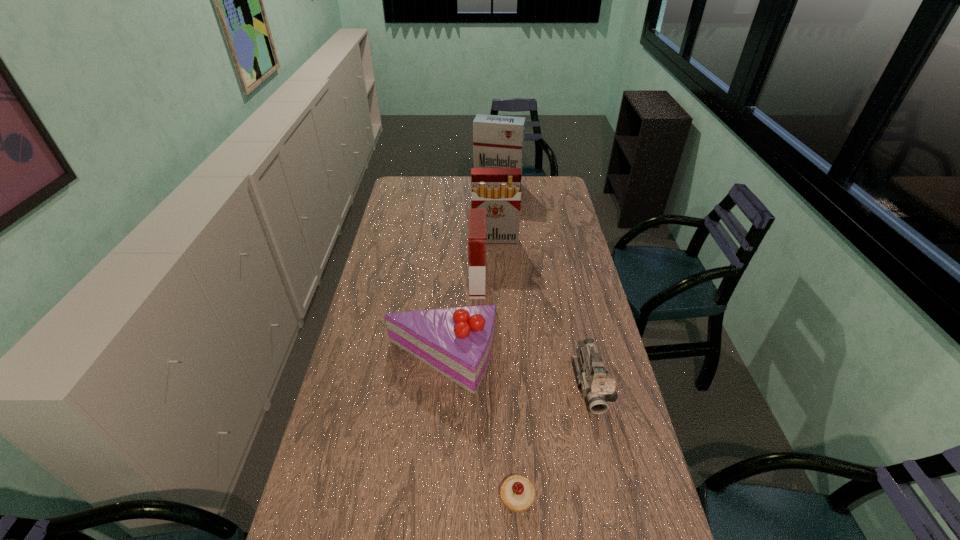
Point out which cigarette_case is positioned as the nearest to the camcorder. Please provide its 2D coordinates. Your answer should be formatted as a tuple, i.e. [(x, y)], where the tuple contains the x and y coordinates of a point satisfying the conditions above.

[(477, 217)]

Locate an element on the screen. vacant region that satisfies the following two spatial constraints: 1. with the lid open on the second farthest object; 2. on the left side of the shortest object is located at coordinates (506, 497).

This screenshot has width=960, height=540. Find the location of `free space that satisfies the following two spatial constraints: 1. on the front-facing side of the nearest cigarette_case; 2. on the back side of the shortest object`. free space that satisfies the following two spatial constraints: 1. on the front-facing side of the nearest cigarette_case; 2. on the back side of the shortest object is located at coordinates (476, 497).

At what (x,y) coordinates should I click in order to perform the action: click on vacant point that satisfies the following two spatial constraints: 1. on the back side of the pastry; 2. on the front-facing side of the fourth nearest object. Please return your answer as a coordinate pair (x, y). The height and width of the screenshot is (540, 960). Looking at the image, I should click on (504, 283).